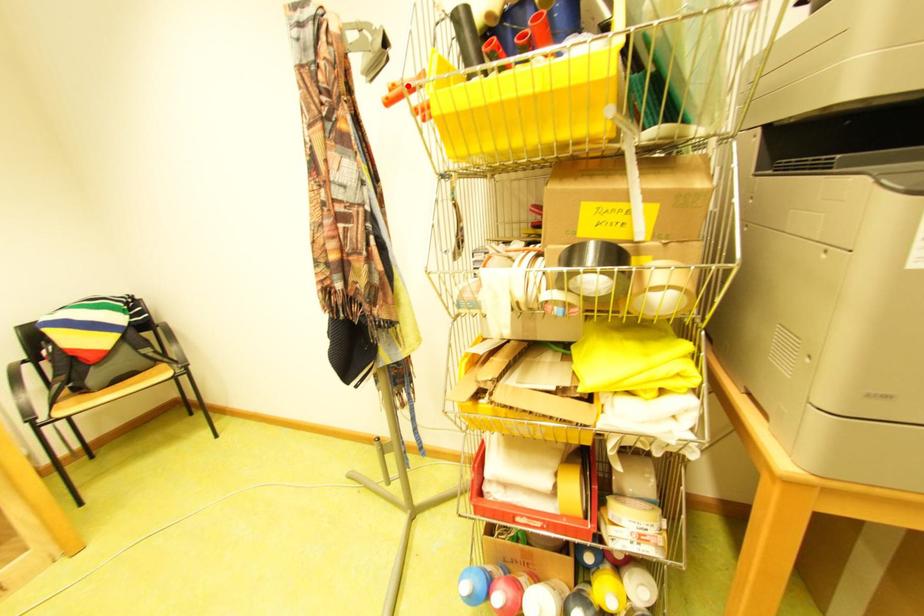
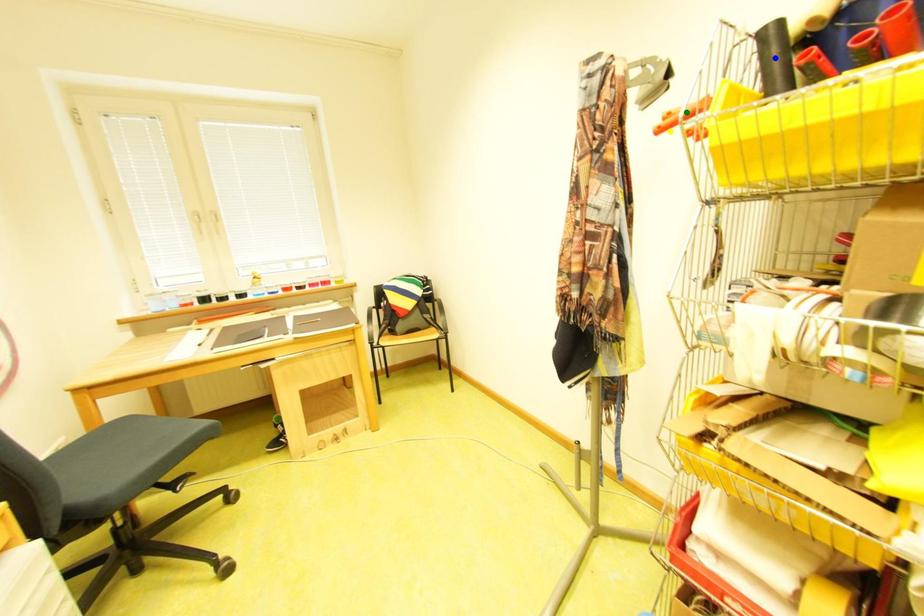
Question: I am providing you with two images of the same scene from different viewpoints. A red point is marked on the first image. You are given multiple points on the second image. Which spot in image 2 lines up with the point in image 1?

Choices:
 (A) yellow point
 (B) blue point
 (C) green point

Answer: (C)